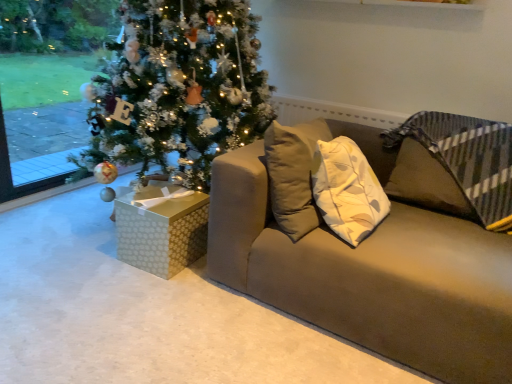
The image size is (512, 384). I want to click on vacant area to the left of gold-patterned gift box at lower left, so click(x=88, y=258).